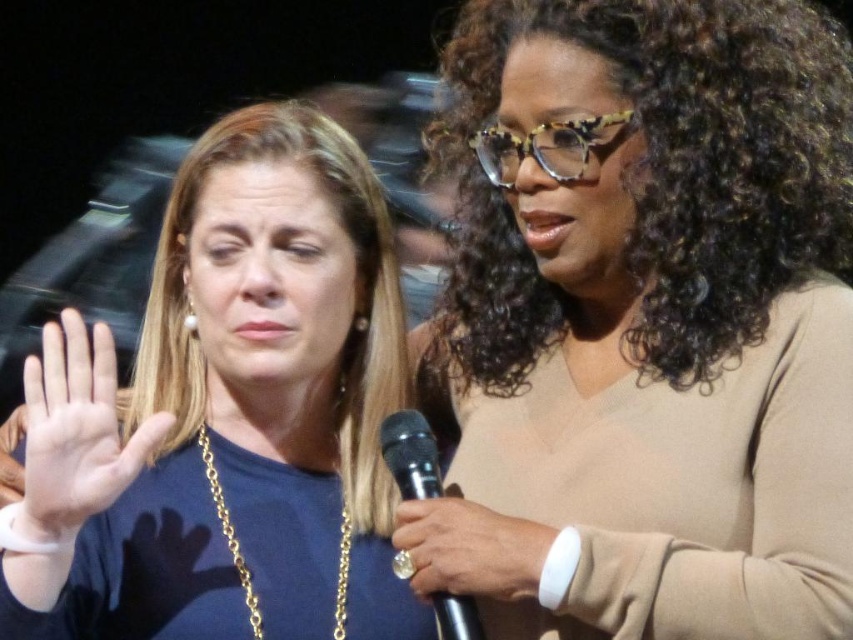
Is point (419, 369) positioned behind point (474, 516)?

That is True.

Is brown matte sweater at upper right above white leather wristband at upper right?

Yes.

Between point (625, 372) and point (427, 556), which one is positioned in front?

Positioned in front is point (427, 556).

Where is `brown matte sweater at upper right`? This screenshot has width=853, height=640. brown matte sweater at upper right is located at coordinates (643, 323).

Who is taller, brown matte sweater at upper right or pale skin palm at center?

Standing taller between the two is brown matte sweater at upper right.

Between brown matte sweater at upper right and pale skin palm at center, which one has less height?

pale skin palm at center is shorter.

Does point (601, 442) come behind point (113, 496)?

Yes, it is behind point (113, 496).

Image resolution: width=853 pixels, height=640 pixels. I want to click on brown matte sweater at upper right, so click(x=643, y=323).

Can you confirm if brown matte sweater at upper right is bigger than blue fabric shirt at left?

Yes, brown matte sweater at upper right is bigger than blue fabric shirt at left.

In the scene shown: Does brown matte sweater at upper right appear under blue fabric shirt at left?

Actually, brown matte sweater at upper right is above blue fabric shirt at left.

Which is in front, point (677, 486) or point (310, 164)?

Point (677, 486) is more forward.

Where is `brown matte sweater at upper right`? brown matte sweater at upper right is located at coordinates (643, 323).